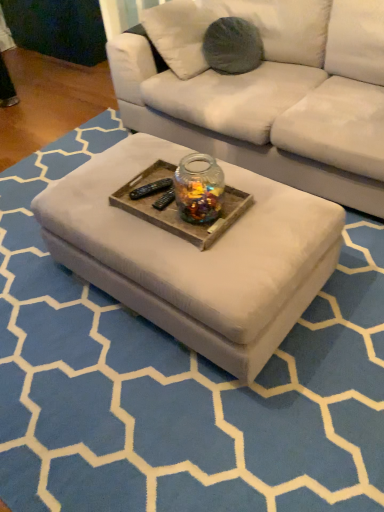
Question: Considering the relative positions of white fabric ottoman at center and transparent glass jar at center in the image provided, is white fabric ottoman at center behind transparent glass jar at center?

Choices:
 (A) yes
 (B) no

Answer: (B)

Question: Does white fabric ottoman at center touch transparent glass jar at center?

Choices:
 (A) no
 (B) yes

Answer: (A)

Question: Is white fabric ottoman at center to the right of transparent glass jar at center from the viewer's perspective?

Choices:
 (A) yes
 (B) no

Answer: (B)

Question: Is transparent glass jar at center at the back of white fabric ottoman at center?

Choices:
 (A) yes
 (B) no

Answer: (B)

Question: From the image's perspective, is white fabric ottoman at center under transparent glass jar at center?

Choices:
 (A) yes
 (B) no

Answer: (A)

Question: Can you confirm if white fabric ottoman at center is bigger than transparent glass jar at center?

Choices:
 (A) yes
 (B) no

Answer: (A)

Question: Does transparent glass jar at center lie behind white fabric ottoman at center?

Choices:
 (A) yes
 (B) no

Answer: (A)

Question: Is transparent glass jar at center positioned with its back to white fabric ottoman at center?

Choices:
 (A) no
 (B) yes

Answer: (A)

Question: Is transparent glass jar at center positioned before white fabric ottoman at center?

Choices:
 (A) yes
 (B) no

Answer: (B)

Question: From a real-world perspective, is transparent glass jar at center located higher than white fabric ottoman at center?

Choices:
 (A) no
 (B) yes

Answer: (B)

Question: Does transparent glass jar at center appear on the right side of white fabric ottoman at center?

Choices:
 (A) yes
 (B) no

Answer: (A)

Question: Can you confirm if transparent glass jar at center is thinner than white fabric ottoman at center?

Choices:
 (A) no
 (B) yes

Answer: (B)

Question: Is white fabric ottoman at center wider than wooden tray at center?

Choices:
 (A) no
 (B) yes

Answer: (B)